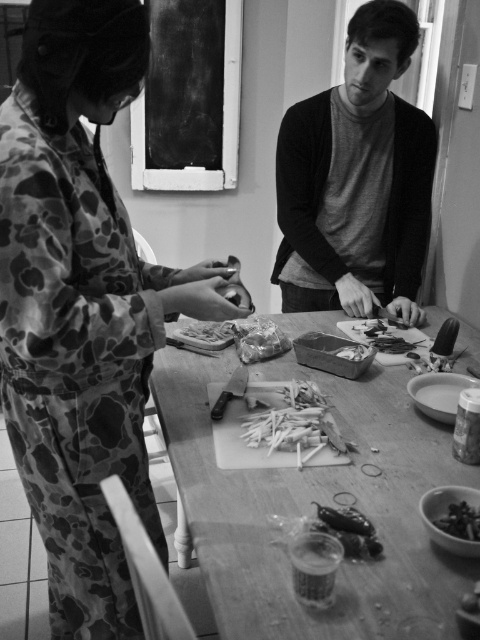
Question: Among these objects, which one is nearest to the camera?

Choices:
 (A) wooden cutting board at center
 (B) camo-patterned pajamas at left
 (C) wooden chopsticks at center
 (D) smooth plastic container at center

Answer: (A)

Question: Is wooden cutting board at center to the right of smooth plastic grapes at lower right from the viewer's perspective?

Choices:
 (A) no
 (B) yes

Answer: (A)

Question: Is camo-patterned pajamas at left to the left of wooden cutting board at center from the viewer's perspective?

Choices:
 (A) yes
 (B) no

Answer: (A)

Question: Does dark gray sweater at center have a lesser width compared to smooth plastic bowl at lower right?

Choices:
 (A) no
 (B) yes

Answer: (A)

Question: Considering the real-world distances, which object is farthest from the wooden chopsticks at center?

Choices:
 (A) dark gray sweater at center
 (B) smooth plastic container at center
 (C) camo-patterned pajamas at left

Answer: (A)

Question: Among these points, which one is farthest from the camera?

Choices:
 (A) (470, 602)
 (B) (472, 524)
 (C) (280, 444)
 (D) (365, 268)

Answer: (D)